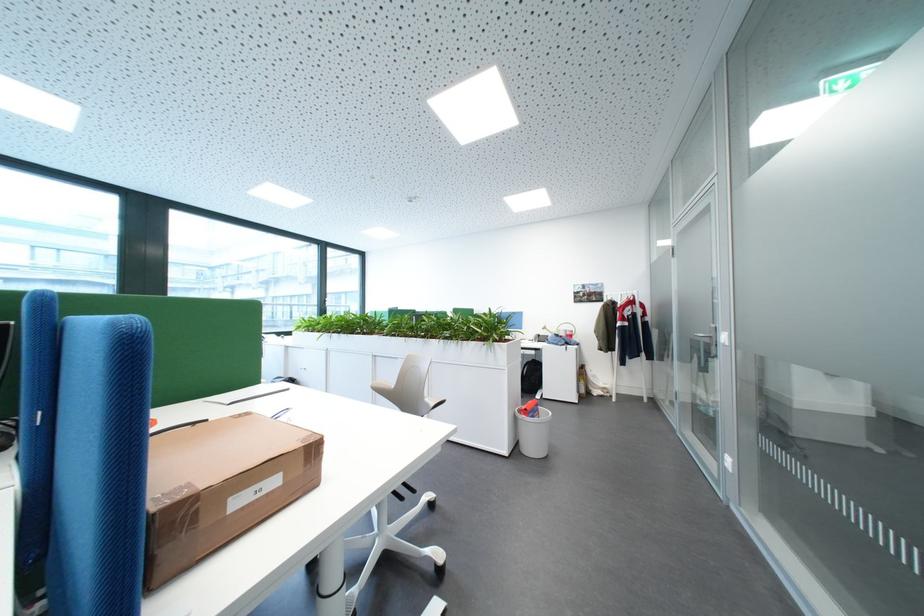
What are the coordinates of `metal door handle` in the screenshot? It's located at (695, 261).